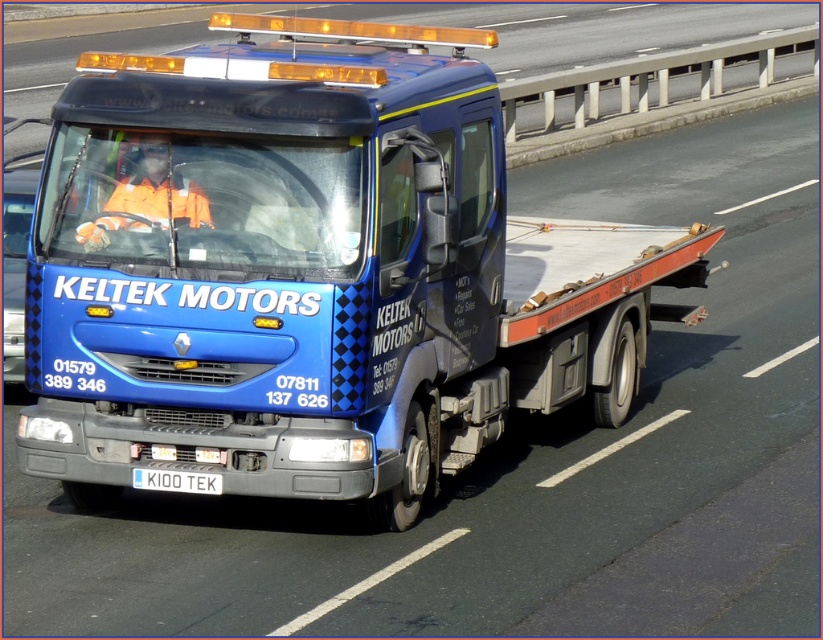
Which is more to the left, blue metallic tow truck at center or white plastic license plate at center?

From the viewer's perspective, white plastic license plate at center appears more on the left side.

Can you confirm if blue metallic tow truck at center is bigger than white plastic license plate at center?

Yes.

Is point (272, 426) farther from camera compared to point (208, 474)?

Yes, it is.

Locate an element on the screen. This screenshot has width=823, height=640. blue metallic tow truck at center is located at coordinates (312, 272).